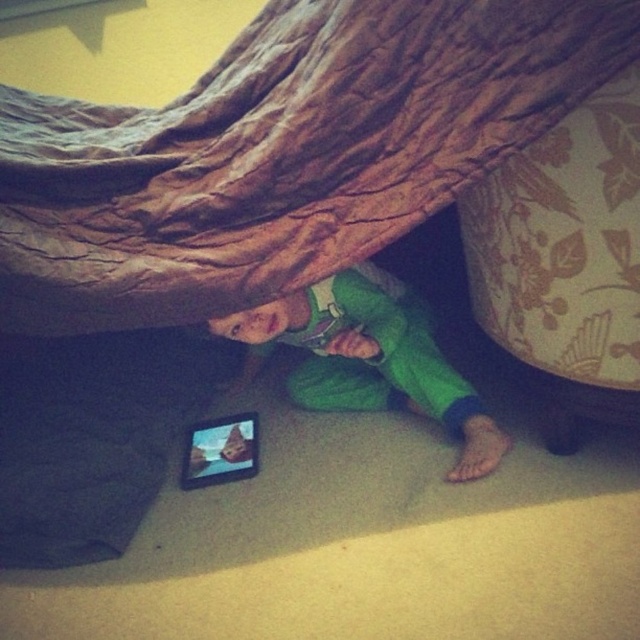
Which of these two, brown textured blanket at upper center or matte black tablet at lower center, stands taller?

Standing taller between the two is brown textured blanket at upper center.

Is brown textured blanket at upper center bigger than matte black tablet at lower center?

Correct, brown textured blanket at upper center is larger in size than matte black tablet at lower center.

This screenshot has width=640, height=640. In order to click on brown textured blanket at upper center in this screenshot , I will do `click(280, 154)`.

Where is `brown textured blanket at upper center`? The image size is (640, 640). brown textured blanket at upper center is located at coordinates (280, 154).

Measure the distance from green fleece pants at lower center to matte black tablet at lower center.

green fleece pants at lower center and matte black tablet at lower center are 29.77 centimeters apart from each other.

Does green fleece pants at lower center have a lesser width compared to matte black tablet at lower center?

Incorrect, green fleece pants at lower center's width is not less than matte black tablet at lower center's.

Is point (371, 301) less distant than point (230, 445)?

Yes, point (371, 301) is in front of point (230, 445).

Locate an element on the screen. green fleece pants at lower center is located at coordinates (369, 356).

Who is positioned more to the left, brown textured blanket at upper center or green fleece pants at lower center?

From the viewer's perspective, brown textured blanket at upper center appears more on the left side.

Does point (333, 10) come in front of point (348, 300)?

Yes.

Between point (333, 29) and point (346, 408), which one is positioned behind?

The point (346, 408) is behind.

Locate an element on the screen. Image resolution: width=640 pixels, height=640 pixels. brown textured blanket at upper center is located at coordinates (280, 154).